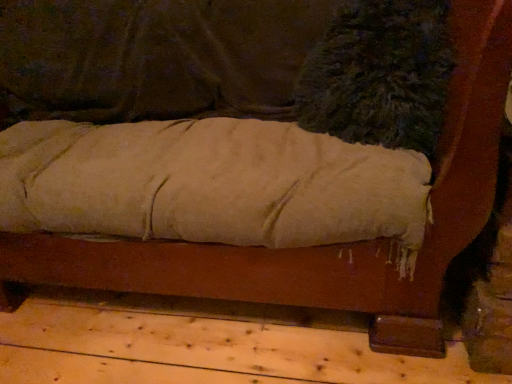
Describe the element at coordinates (380, 75) in the screenshot. I see `green fuzzy animal at upper right` at that location.

Where is `green fuzzy animal at upper right`? This screenshot has width=512, height=384. green fuzzy animal at upper right is located at coordinates (380, 75).

Measure the distance between point (355,119) and camera.

A distance of 3.60 feet exists between point (355,119) and camera.

The height and width of the screenshot is (384, 512). Find the location of `green fuzzy animal at upper right`. green fuzzy animal at upper right is located at coordinates (380, 75).